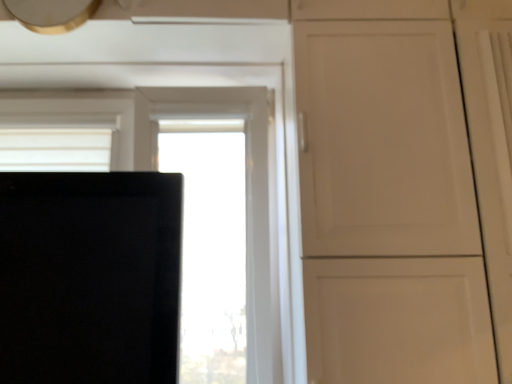
Question: From the image's perspective, is transparent glass window at center above or below metallic gold exhaust hood at upper left?

Choices:
 (A) above
 (B) below

Answer: (B)

Question: Is transparent glass window at center to the left or to the right of metallic gold exhaust hood at upper left in the image?

Choices:
 (A) right
 (B) left

Answer: (A)

Question: Considering their positions, is transparent glass window at center located in front of or behind metallic gold exhaust hood at upper left?

Choices:
 (A) behind
 (B) front

Answer: (A)

Question: Based on their sizes in the image, would you say metallic gold exhaust hood at upper left is bigger or smaller than transparent glass window at center?

Choices:
 (A) small
 (B) big

Answer: (A)

Question: From a real-world perspective, is metallic gold exhaust hood at upper left above or below transparent glass window at center?

Choices:
 (A) above
 (B) below

Answer: (A)

Question: Visually, is metallic gold exhaust hood at upper left positioned to the left or to the right of transparent glass window at center?

Choices:
 (A) right
 (B) left

Answer: (B)

Question: Considering their positions, is metallic gold exhaust hood at upper left located in front of or behind transparent glass window at center?

Choices:
 (A) behind
 (B) front

Answer: (B)